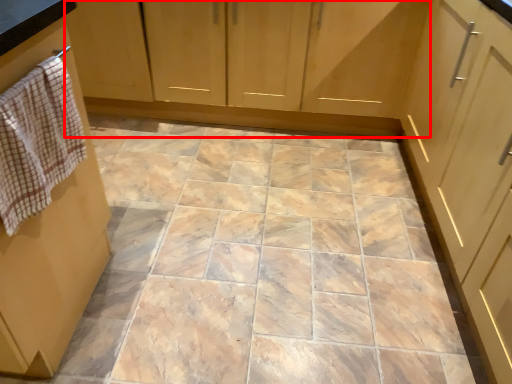
Question: Observing the image, what is the correct spatial positioning of cabinetry (annotated by the red box) in reference to hand towel?

Choices:
 (A) right
 (B) left

Answer: (A)